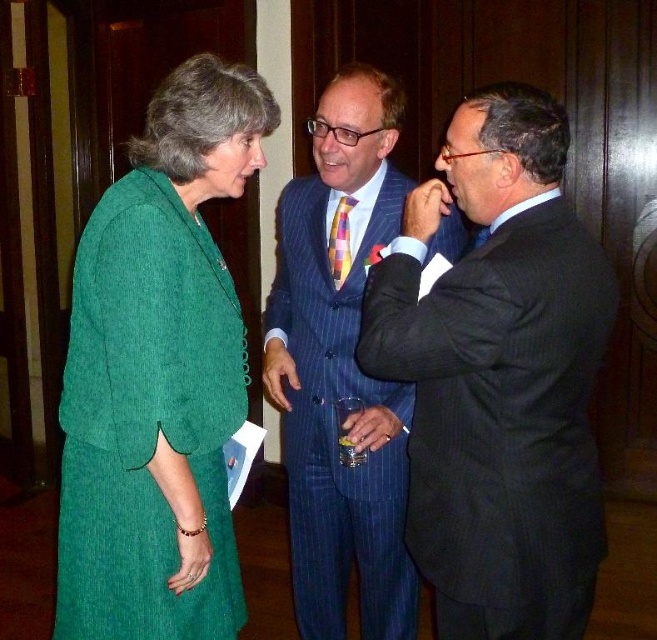
Question: Does dark blue pinstripe suit at center have a smaller size compared to green corduroy dress at left?

Choices:
 (A) yes
 (B) no

Answer: (B)

Question: Among these points, which one is farthest from the camera?

Choices:
 (A) (338, 230)
 (B) (476, 394)

Answer: (A)

Question: Does dark blue pinstripe suit at center appear on the right side of green corduroy dress at left?

Choices:
 (A) no
 (B) yes

Answer: (B)

Question: Considering the real-world distances, which object is closest to the green corduroy dress at left?

Choices:
 (A) blue pinstripe suit at center
 (B) dark blue pinstripe suit at center
 (C) multicolored woven tie at center

Answer: (A)

Question: Is green corduroy dress at left below blue pinstripe suit at center?

Choices:
 (A) no
 (B) yes

Answer: (A)

Question: Estimate the real-world distances between objects in this image. Which object is closer to the multicolored woven tie at center?

Choices:
 (A) dark blue pinstripe suit at center
 (B) blue pinstripe suit at center

Answer: (B)